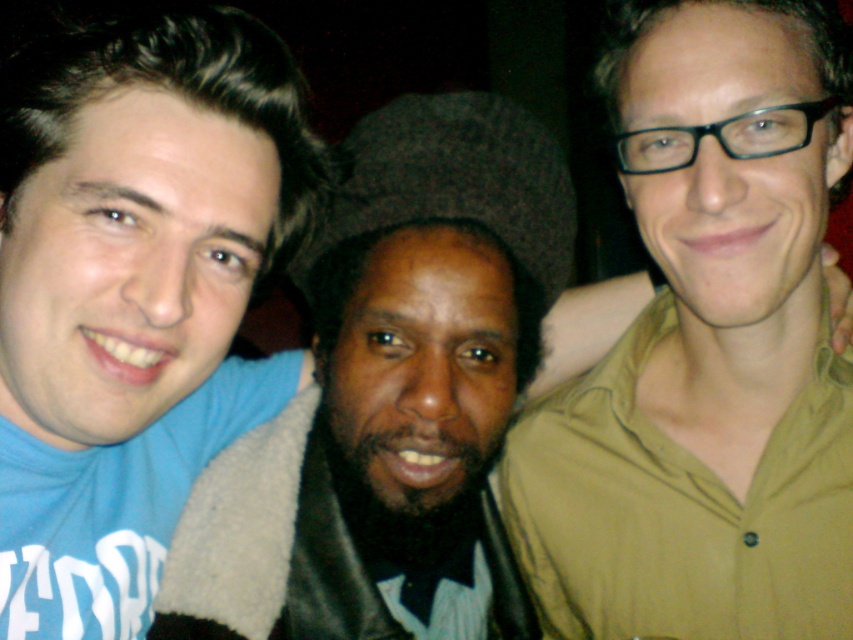
Which is more to the right, green matte shirt at right or blue t-shirt at left?

green matte shirt at right

Find the location of `green matte shirt at right`. green matte shirt at right is located at coordinates (706, 348).